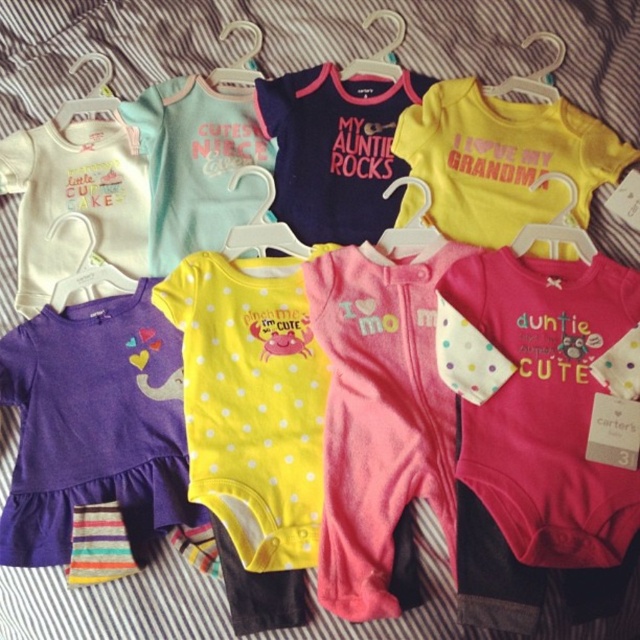
Who is shorter, pink fleece onesie at center-right or yellow polka dot onesie at center?

With less height is pink fleece onesie at center-right.

Does pink fleece onesie at center-right appear on the left side of yellow polka dot onesie at center?

In fact, pink fleece onesie at center-right is to the right of yellow polka dot onesie at center.

This screenshot has height=640, width=640. Find the location of `pink fleece onesie at center-right`. pink fleece onesie at center-right is located at coordinates (547, 400).

Who is lower down, pink fleece onesie at center or yellow polka dot onesie at center?

Positioned lower is pink fleece onesie at center.

Who is taller, pink fleece onesie at center or yellow polka dot onesie at center?

pink fleece onesie at center

Find the location of a particular element. The height and width of the screenshot is (640, 640). pink fleece onesie at center is located at coordinates (380, 419).

Is yellow polka dot onesie at center thinner than white matte bib at upper left?

In fact, yellow polka dot onesie at center might be wider than white matte bib at upper left.

Which is behind, point (291, 406) or point (26, 170)?

Positioned behind is point (26, 170).

Identify the location of yellow polka dot onesie at center. Image resolution: width=640 pixels, height=640 pixels. (252, 401).

This screenshot has width=640, height=640. In order to click on yellow polka dot onesie at center in this screenshot , I will do `click(252, 401)`.